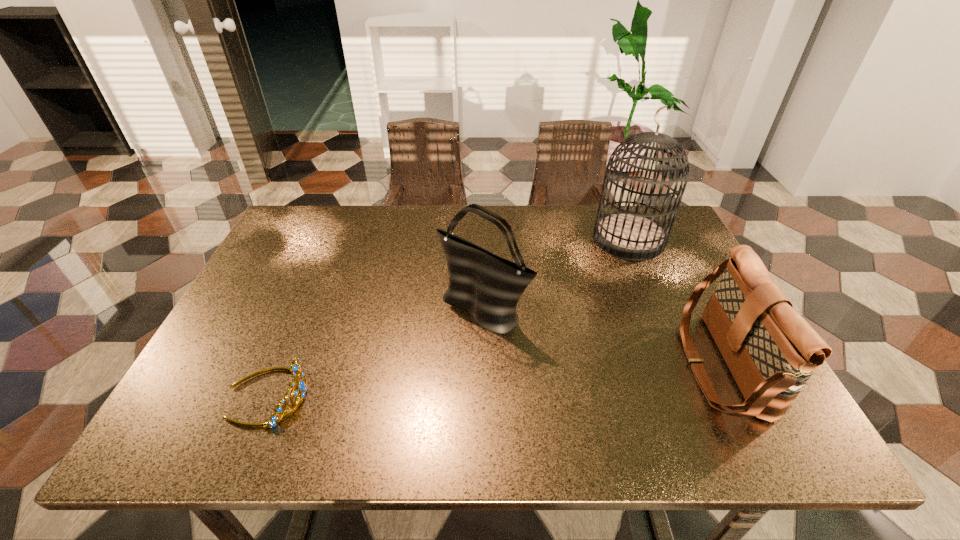
I want to click on free space located 0.370m on the front-facing side of the shorter shoulder bag, so click(x=519, y=366).

The image size is (960, 540). What are the coordinates of `vacant space positioned 0.380m on the front-facing side of the shorter shoulder bag` in the screenshot? It's located at (516, 366).

Identify the location of free location located on the front-facing side of the shorter shoulder bag. (642, 366).

The height and width of the screenshot is (540, 960). Identify the location of vacant area located on the front-facing side of the shortest object. (444, 395).

At what (x,y) coordinates should I click in order to perform the action: click on object that is positioned at the far edge. Please return your answer as a coordinate pair (x, y). This screenshot has width=960, height=540. Looking at the image, I should click on (628, 235).

Find the location of a particular element. shoulder bag present at the near edge is located at coordinates [771, 351].

At what (x,y) coordinates should I click in order to perform the action: click on tiara that is at the near edge. Please return your answer as a coordinate pair (x, y). Looking at the image, I should click on (296, 369).

Identify the location of object positioned at the left edge. The image size is (960, 540). (296, 369).

The image size is (960, 540). In order to click on birdcage present at the right edge in this screenshot , I will do `click(628, 235)`.

Identify the location of shoulder bag located at the right edge. This screenshot has width=960, height=540. (771, 351).